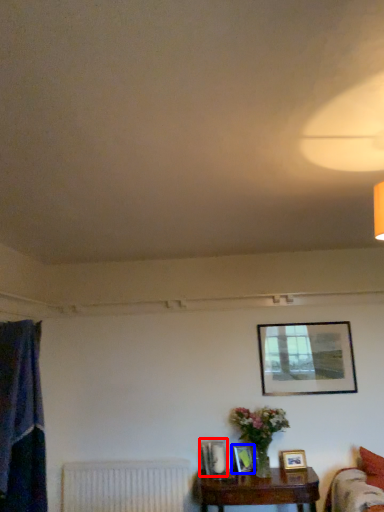
Question: Which of the following is the farthest to the observer, picture frame (highlighted by a red box) or picture frame (highlighted by a blue box)?

Choices:
 (A) picture frame
 (B) picture frame

Answer: (B)